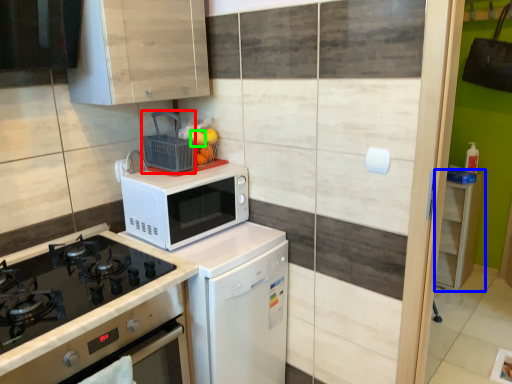
Question: Considering the real-world distances, which object is farthest from basket (highlighted by a red box)? cabinetry (highlighted by a blue box) or orange (highlighted by a green box)?

Choices:
 (A) cabinetry
 (B) orange

Answer: (A)